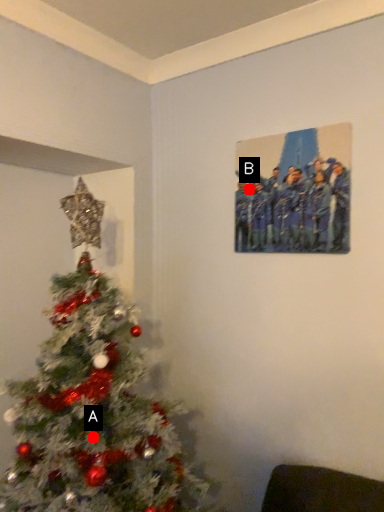
Question: Two points are circled on the image, labeled by A and B beside each circle. Which point is farther from the camera taking this photo?

Choices:
 (A) A is further
 (B) B is further

Answer: (B)